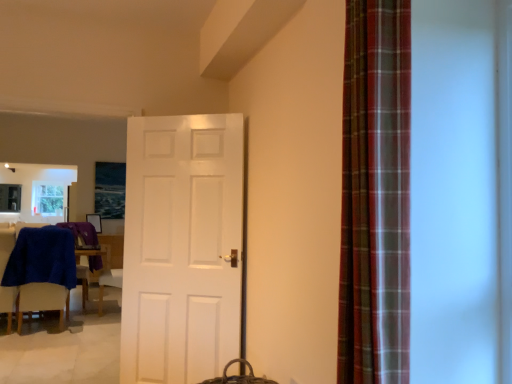
Question: Is point (350, 317) positioned closer to the camera than point (22, 286)?

Choices:
 (A) farther
 (B) closer

Answer: (B)

Question: Would you say plaid fabric curtain at right is inside or outside blue fabric chair at left?

Choices:
 (A) inside
 (B) outside

Answer: (B)

Question: Which object is the closest to the plaid fabric curtain at right?

Choices:
 (A) blue fabric chair at left
 (B) white matte door at center

Answer: (B)

Question: Which of these objects is positioned farthest from the white matte door at center?

Choices:
 (A) plaid fabric curtain at right
 (B) blue fabric chair at left

Answer: (B)